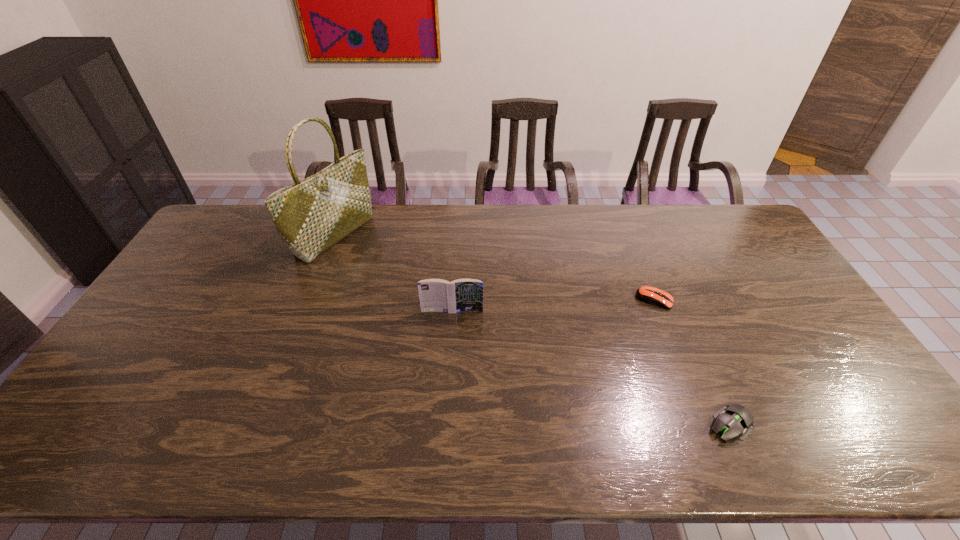
Identify the location of object at the far edge. The image size is (960, 540). (312, 215).

Where is `object present at the near edge`? object present at the near edge is located at coordinates (734, 420).

In the image, there is a desktop. Identify the location of vacant space at the far edge. (573, 241).

Where is `free region at the near edge of the desktop`? The height and width of the screenshot is (540, 960). free region at the near edge of the desktop is located at coordinates (211, 433).

This screenshot has width=960, height=540. Identify the location of vacant space at the left edge. (x=102, y=399).

Find the location of a particular element. The width and height of the screenshot is (960, 540). vacant region at the right edge of the desktop is located at coordinates (778, 267).

Find the location of a particular element. free region at the near left corner is located at coordinates (63, 455).

Identify the location of free space at the near right corner of the desktop. (846, 432).

Where is `empty space between the nearer computer mouse and the farther computer mouse`? empty space between the nearer computer mouse and the farther computer mouse is located at coordinates (692, 362).

Image resolution: width=960 pixels, height=540 pixels. Find the location of `unoccupied position between the third shortest object and the nearest object`. unoccupied position between the third shortest object and the nearest object is located at coordinates (591, 368).